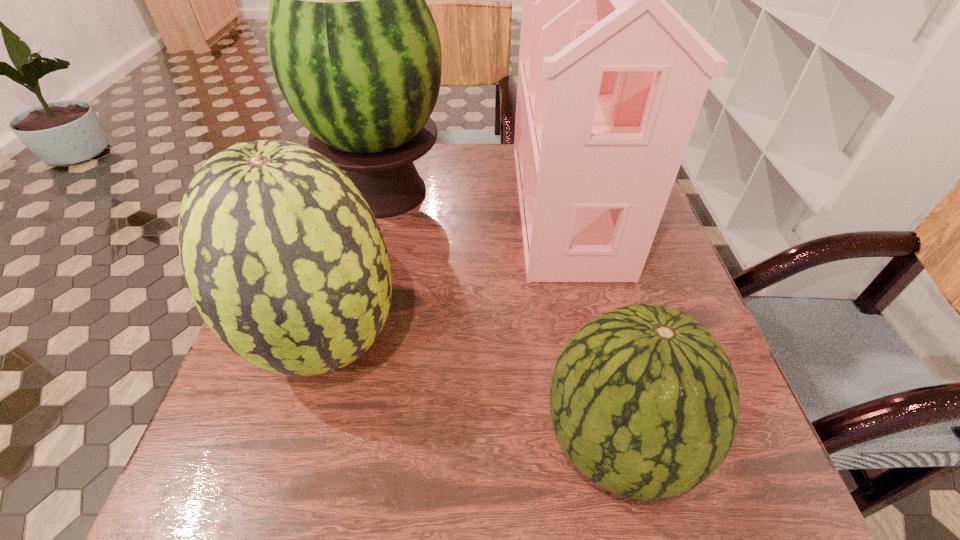
The height and width of the screenshot is (540, 960). In order to click on vacant space at the near edge of the desktop in this screenshot , I will do (x=378, y=518).

In the image, there is a desktop. Where is `vacant space at the left edge`? This screenshot has height=540, width=960. vacant space at the left edge is located at coordinates 228,406.

The height and width of the screenshot is (540, 960). What are the coordinates of `free space at the right edge of the desktop` in the screenshot? It's located at (663, 248).

At what (x,y) coordinates should I click in order to perform the action: click on vacant area that lies between the farthest watermelon and the shortest object. Please return your answer as a coordinate pair (x, y). Looking at the image, I should click on coord(500,317).

At what (x,y) coordinates should I click in order to perform the action: click on empty space that is in between the second shortest watermelon and the dollhouse. Please return your answer as a coordinate pair (x, y). The image size is (960, 540). Looking at the image, I should click on (446, 273).

This screenshot has height=540, width=960. Find the location of `empty location between the farthest watermelon and the dollhouse`. empty location between the farthest watermelon and the dollhouse is located at coordinates (475, 199).

Where is `blank region between the rightmost watermelon and the farthest watermelon`? Image resolution: width=960 pixels, height=540 pixels. blank region between the rightmost watermelon and the farthest watermelon is located at coordinates (500, 317).

Locate an element on the screen. free area in between the rightmost watermelon and the second shortest object is located at coordinates (471, 392).

The image size is (960, 540). In order to click on free spot between the third tallest object and the rightmost watermelon in this screenshot , I will do `click(471, 392)`.

At what (x,y) coordinates should I click in order to perform the action: click on object that is the closest to the rightmost watermelon. Please return your answer as a coordinate pair (x, y). Image resolution: width=960 pixels, height=540 pixels. Looking at the image, I should click on (609, 90).